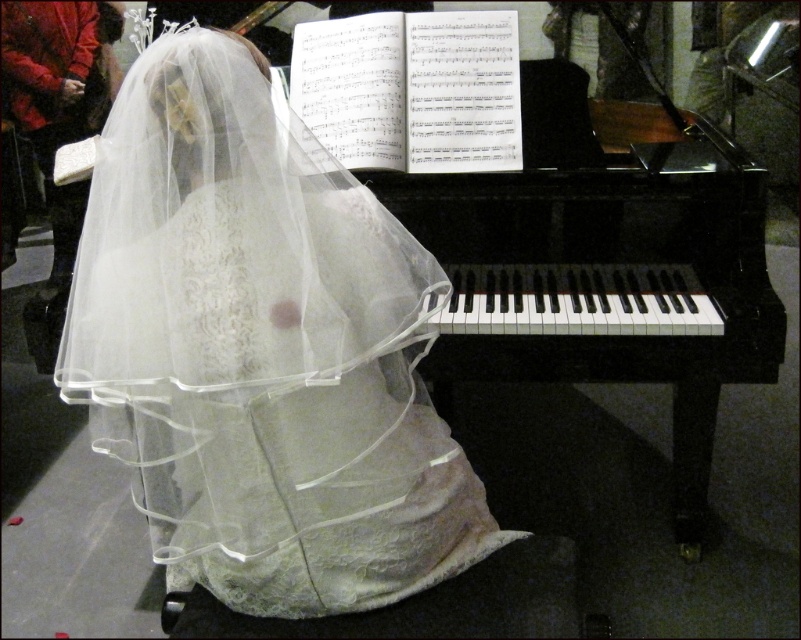
You are a photographer setting up for a wedding photoshoot. You need to position a light to the right of the black polished piano at center so it illuminates the white lace dress at center. Will the light hit the dress if placed there?

The white lace dress at center is to the left of the black polished piano at center. Placing the light to the right of the piano would position it away from the dress, so the light likely won

You are a photographer setting up for a wedding photo session. You need to position a light source so that it illuminates both the white lace dress at center and the black polished piano at center equally. Considering their heights, which object should be placed closer to the light source to achieve even illumination?

The white lace dress at center has a lesser height compared to the black polished piano at center, so to achieve even illumination, the white lace dress at center should be placed closer to the light source since it is shorter and requires the light to reach it effectively.

You are standing in front of the grand piano and want to move to the right side of the white lace dress at center. Based on the coordinates provided, will you need to move to your left or right to reach the dress?

The white lace dress at center is located at point (260,349). Since the x coordinate is 0.547, which is to the right of the center point 0.5, you should move to your right to reach the white lace dress at center.